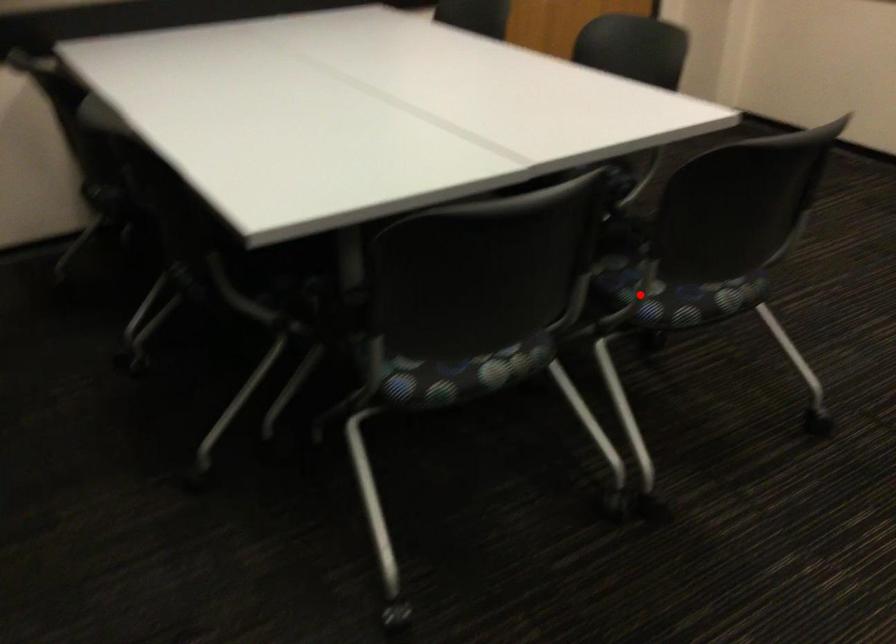
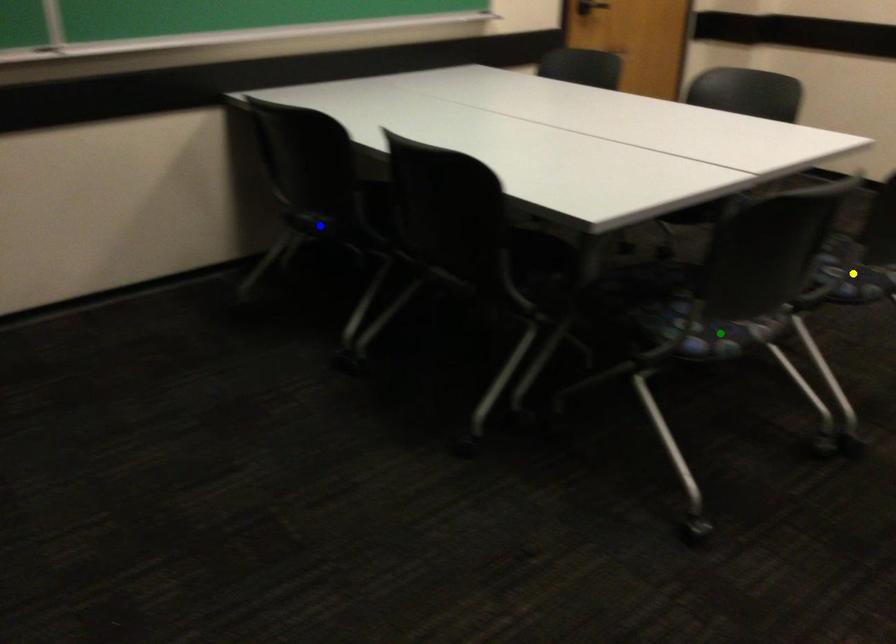
Question: I am providing you with two images of the same scene from different viewpoints. A red point is marked on the first image. You are given multiple points on the second image. Can you choose the point in image 2 that corresponds to the point in image 1?

Choices:
 (A) yellow point
 (B) green point
 (C) blue point

Answer: (A)